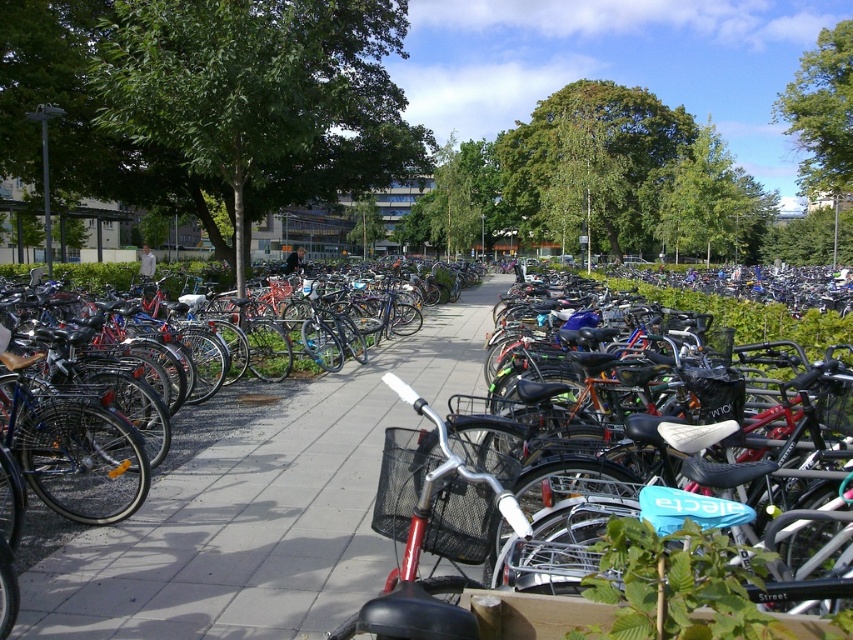
Who is higher up, gray concrete pavement at center or matte black bicycle at center?

matte black bicycle at center

Which is behind, point (299, 492) or point (399, 509)?

The point (299, 492) is behind.

Image resolution: width=853 pixels, height=640 pixels. What are the coordinates of `gray concrete pavement at center` in the screenshot? It's located at (260, 509).